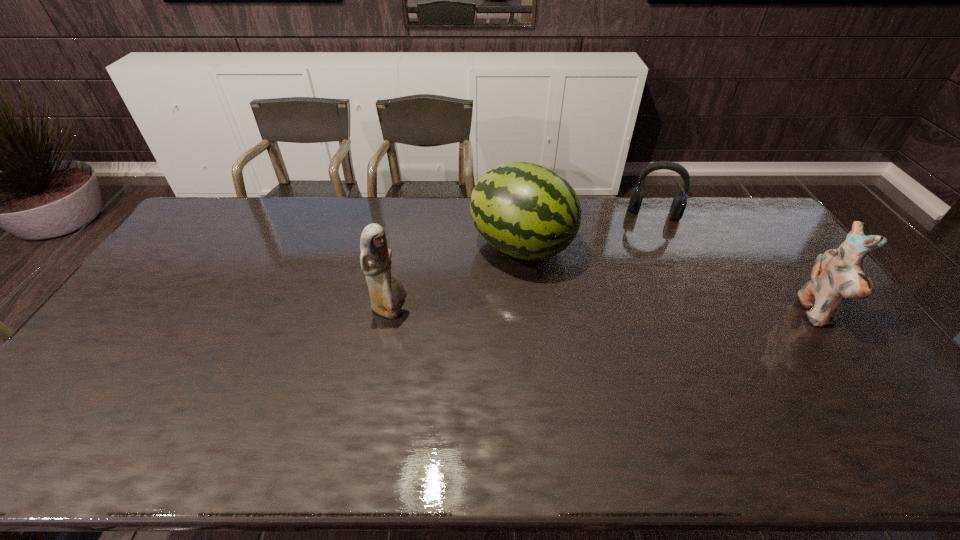
This screenshot has width=960, height=540. I want to click on free space between the right figurine and the watermelon, so click(x=668, y=280).

The image size is (960, 540). In order to click on vacant point located between the right figurine and the watermelon in this screenshot , I will do `click(668, 280)`.

What are the coordinates of `free area in between the left figurine and the watermelon` in the screenshot? It's located at (456, 279).

Where is `empty location between the shortest object and the left figurine`? This screenshot has height=540, width=960. empty location between the shortest object and the left figurine is located at coordinates (522, 262).

Locate an element on the screen. This screenshot has width=960, height=540. free point between the leftmost object and the shortest object is located at coordinates click(x=522, y=262).

This screenshot has width=960, height=540. I want to click on blank region between the leftmost object and the shortest object, so click(x=522, y=262).

This screenshot has width=960, height=540. Find the location of `empty location between the headset and the leftmost object`. empty location between the headset and the leftmost object is located at coordinates click(x=522, y=262).

Identify the location of vacant area between the leftmost object and the watermelon. (456, 279).

Find the location of a particular element. empty space between the left figurine and the third object from right to left is located at coordinates (456, 279).

I want to click on object that ranks as the second closest to the shortest object, so click(837, 274).